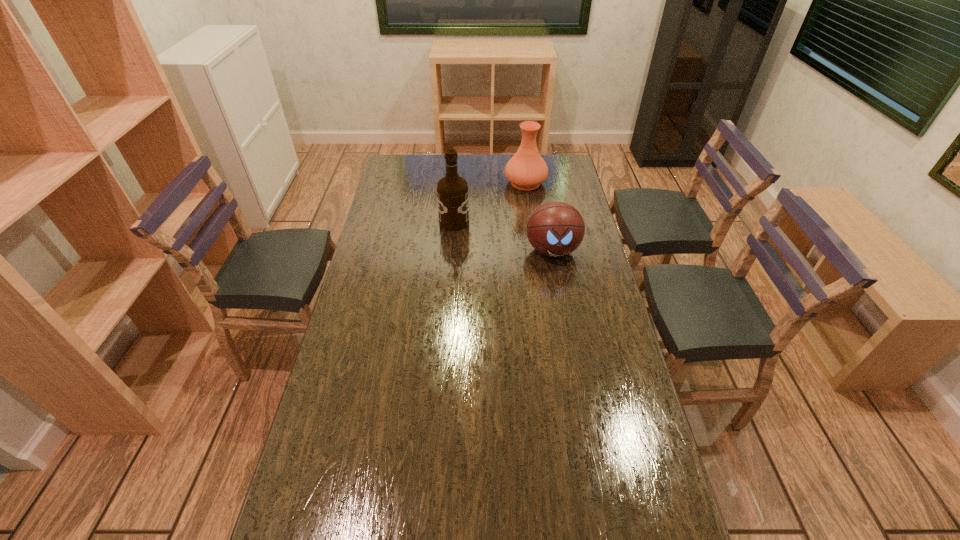
Where is `the second farthest object`? This screenshot has width=960, height=540. the second farthest object is located at coordinates (452, 191).

The image size is (960, 540). I want to click on the leftmost object, so click(452, 191).

Find the location of `the second tallest object`. the second tallest object is located at coordinates (526, 170).

Identify the location of vase. This screenshot has height=540, width=960. (526, 170).

At what (x,y) coordinates should I click in order to perform the action: click on the shortest object. Please return your answer as a coordinate pair (x, y). The width and height of the screenshot is (960, 540). Looking at the image, I should click on (555, 229).

Locate an element on the screen. The width and height of the screenshot is (960, 540). basketball is located at coordinates (555, 229).

Find the location of a particular element. This screenshot has width=960, height=540. free location located on the label of the second farthest object is located at coordinates (484, 222).

At what (x,y) coordinates should I click in order to perform the action: click on free space located 0.170m on the left of the second tallest object. Please return your answer as a coordinate pair (x, y). The image size is (960, 540). Looking at the image, I should click on (468, 183).

Where is `vacant region located on the back of the shortest object`? The width and height of the screenshot is (960, 540). vacant region located on the back of the shortest object is located at coordinates (540, 180).

Find the location of a particular element. Image resolution: width=960 pixels, height=540 pixels. object that is at the far edge is located at coordinates (526, 170).